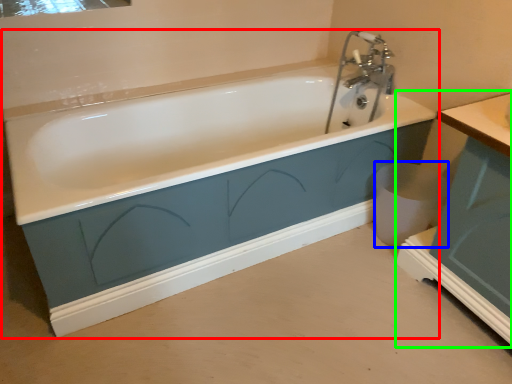
Question: Considering the real-world distances, which object is farthest from bathtub (highlighted by a red box)? toilet bowl (highlighted by a blue box) or vanity (highlighted by a green box)?

Choices:
 (A) toilet bowl
 (B) vanity

Answer: (B)